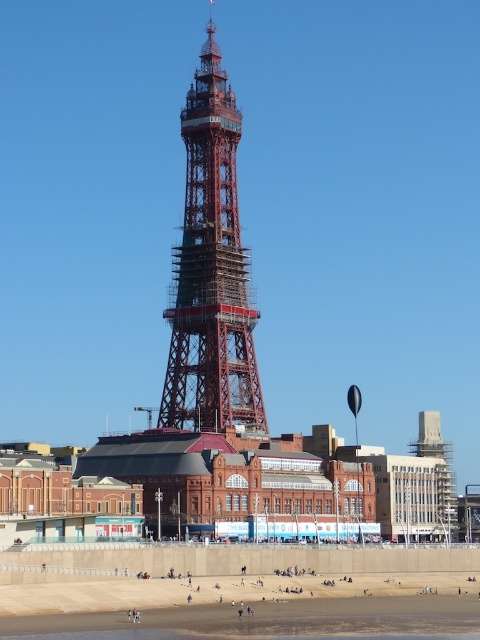
Question: Does red metal eiffel tower at center appear on the left side of sandy beach at lower center?

Choices:
 (A) no
 (B) yes

Answer: (B)

Question: Which point appears farthest from the camera in this image?

Choices:
 (A) (350, 612)
 (B) (249, 408)

Answer: (B)

Question: Is red metal eiffel tower at center to the left of sandy beach at lower center from the viewer's perspective?

Choices:
 (A) yes
 (B) no

Answer: (A)

Question: Can you confirm if red metal eiffel tower at center is positioned to the right of sandy beach at lower center?

Choices:
 (A) yes
 (B) no

Answer: (B)

Question: Which point appears closest to the camera in this image?

Choices:
 (A) (412, 602)
 (B) (233, 296)

Answer: (A)

Question: Which point is farther to the camera?

Choices:
 (A) (182, 307)
 (B) (406, 582)

Answer: (A)